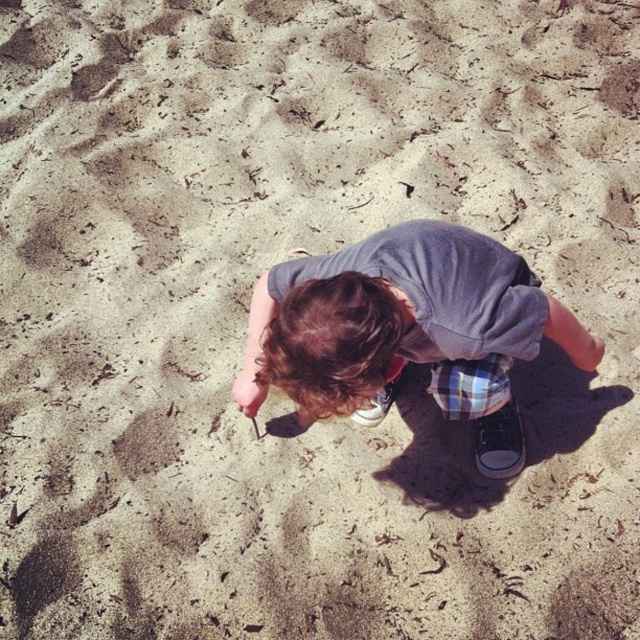
Question: Which point is farther to the camera?

Choices:
 (A) gray fabric at center
 (B) gray cotton shirt at center
 (C) matte gray shoe at center

Answer: (C)

Question: Which of these objects is positioned farthest from the gray fabric at center?

Choices:
 (A) black canvas shoe at lower right
 (B) matte gray shoe at center

Answer: (B)

Question: Does gray fabric at center appear on the left side of black canvas shoe at lower right?

Choices:
 (A) yes
 (B) no

Answer: (A)

Question: Does gray cotton shirt at center appear over black canvas shoe at lower right?

Choices:
 (A) no
 (B) yes

Answer: (B)

Question: Among these objects, which one is nearest to the camera?

Choices:
 (A) black canvas shoe at lower right
 (B) gray fabric at center
 (C) matte gray shoe at center
 (D) gray cotton shirt at center

Answer: (D)

Question: Does gray cotton shirt at center appear under matte gray shoe at center?

Choices:
 (A) no
 (B) yes

Answer: (A)